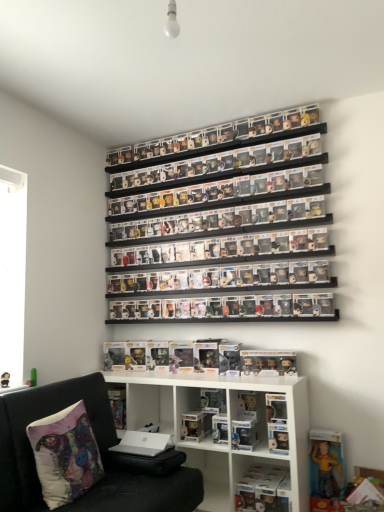
Describe the element at coordinates (260, 488) in the screenshot. I see `clear plastic figure at lower center` at that location.

Describe the element at coordinates (65, 455) in the screenshot. I see `white fabric pillow with colorful design at lower left` at that location.

Describe the element at coordinates (101, 457) in the screenshot. I see `black fabric couch at lower left` at that location.

Measure the distance between point (76, 380) and camera.

8.03 feet.

The width and height of the screenshot is (384, 512). In order to click on clear plastic figures at upper center, the fourth shelf ordered from the bottom in this screenshot , I will do coord(212,137).

Describe the element at coordinates (325, 469) in the screenshot. This screenshot has width=384, height=512. I see `yellow fabric figure at lower right, acting as the 1th toy starting from the bottom` at that location.

Image resolution: width=384 pixels, height=512 pixels. In order to click on clear plastic figure at lower center in this screenshot , I will do (260, 488).

Does point (76, 437) come behind point (293, 352)?

No, (76, 437) is in front of (293, 352).

From a real-world perspective, does white fabric pillow with colorful design at lower left sit lower than translucent plastic figures at lower center, marked as the first toy in a top-to-bottom arrangement?

Indeed, from a real-world perspective, white fabric pillow with colorful design at lower left is positioned beneath translucent plastic figures at lower center, marked as the first toy in a top-to-bottom arrangement.

What are the coordinates of `pillow on the left side of translucent plastic figures at lower center, marked as the second toy in a right-to-left arrangement` in the screenshot? It's located at (65, 455).

From the image's perspective, which one is positioned lower, white fabric pillow with colorful design at lower left or translucent plastic figures at lower center, marked as the first toy in a top-to-bottom arrangement?

From the image's view, white fabric pillow with colorful design at lower left is below.

Considering the relative sizes of white fabric pillow with colorful design at lower left and clear plastic figures at upper center, the fourth shelf ordered from the bottom, in the image provided, is white fabric pillow with colorful design at lower left smaller than clear plastic figures at upper center, the fourth shelf ordered from the bottom,?

Actually, white fabric pillow with colorful design at lower left might be larger than clear plastic figures at upper center, the fourth shelf ordered from the bottom.

At what (x,y) coordinates should I click in order to perform the action: click on pillow on the left of clear plastic figures at upper center, marked as the 1th shelf in a top-to-bottom arrangement. Please return your answer as a coordinate pair (x, y). Looking at the image, I should click on (65, 455).

Is white fabric pillow with colorful design at lower left looking in the opposite direction of clear plastic figures at upper center, marked as the 1th shelf in a top-to-bottom arrangement?

That's not correct — white fabric pillow with colorful design at lower left is not looking away from clear plastic figures at upper center, marked as the 1th shelf in a top-to-bottom arrangement.

In terms of height, does white fabric pillow with colorful design at lower left look taller or shorter compared to clear plastic figures at upper center, marked as the 1th shelf in a top-to-bottom arrangement?

Considering their sizes, white fabric pillow with colorful design at lower left has more height than clear plastic figures at upper center, marked as the 1th shelf in a top-to-bottom arrangement.

Is clear plastic figures at center, the 2th shelf ordered from the bottom, with white matte shelf at lower center, arranged as the first shelf when ordered from the bottom?

clear plastic figures at center, the 2th shelf ordered from the bottom, and white matte shelf at lower center, arranged as the first shelf when ordered from the bottom, are clearly separated.

How many degrees apart are the facing directions of clear plastic figures at center, the third shelf when ordered from top to bottom, and white matte shelf at lower center, positioned as the 4th shelf in top-to-bottom order?

clear plastic figures at center, the third shelf when ordered from top to bottom, and white matte shelf at lower center, positioned as the 4th shelf in top-to-bottom order, are facing 0.694 degrees away from each other.

Is clear plastic figures at center, the 2th shelf ordered from the bottom, further to camera compared to white matte shelf at lower center, positioned as the 4th shelf in top-to-bottom order?

Yes, clear plastic figures at center, the 2th shelf ordered from the bottom, is behind white matte shelf at lower center, positioned as the 4th shelf in top-to-bottom order.

Is clear plastic figures at center, the third shelf when ordered from top to bottom, facing away from white matte shelf at lower center, positioned as the 4th shelf in top-to-bottom order?

No, clear plastic figures at center, the third shelf when ordered from top to bottom,'s orientation is not away from white matte shelf at lower center, positioned as the 4th shelf in top-to-bottom order.

Consider the image. From a real-world perspective, between matte plastic figurine at center, positioned as the 1th toy in left-to-right order, and clear plastic figures at center, the 2th shelf ordered from the bottom, who is vertically lower?

matte plastic figurine at center, positioned as the 1th toy in left-to-right order, is physically lower.

Does matte plastic figurine at center, positioned as the second toy in bottom-to-top order, contain clear plastic figures at center, the third shelf when ordered from top to bottom?

No, clear plastic figures at center, the third shelf when ordered from top to bottom, is not surrounded by matte plastic figurine at center, positioned as the second toy in bottom-to-top order.

Is matte plastic figurine at center, the 2th toy from the top, bigger than clear plastic figures at center, the 2th shelf ordered from the bottom?

Actually, matte plastic figurine at center, the 2th toy from the top, might be smaller than clear plastic figures at center, the 2th shelf ordered from the bottom.

Looking at their sizes, would you say black fabric couch at lower left is wider or thinner than clear plastic figures at center, which appears as the 2th shelf when viewed from the top?

black fabric couch at lower left is wider than clear plastic figures at center, which appears as the 2th shelf when viewed from the top.

Is black fabric couch at lower left looking in the opposite direction of clear plastic figures at center, which appears as the 2th shelf when viewed from the top?

No, black fabric couch at lower left is not facing away from clear plastic figures at center, which appears as the 2th shelf when viewed from the top.

Which point is more distant from viewer, (33, 463) or (114, 206)?

Point (114, 206)

Between black fabric couch at lower left and clear plastic figures at center, which ranks as the third shelf in bottom-to-top order, which one has larger size?

With larger size is black fabric couch at lower left.

From the image's perspective, is clear plastic figures at upper center, marked as the 1th shelf in a top-to-bottom arrangement, under clear plastic figures at center, which ranks as the third shelf in bottom-to-top order?

Incorrect, from the image's perspective, clear plastic figures at upper center, marked as the 1th shelf in a top-to-bottom arrangement, is higher than clear plastic figures at center, which ranks as the third shelf in bottom-to-top order.

From the picture: Can you confirm if clear plastic figures at upper center, marked as the 1th shelf in a top-to-bottom arrangement, is positioned to the right of clear plastic figures at center, which ranks as the third shelf in bottom-to-top order?

Incorrect, clear plastic figures at upper center, marked as the 1th shelf in a top-to-bottom arrangement, is not on the right side of clear plastic figures at center, which ranks as the third shelf in bottom-to-top order.

Does clear plastic figures at upper center, the fourth shelf ordered from the bottom, turn towards clear plastic figures at center, which appears as the 2th shelf when viewed from the top?

No, clear plastic figures at upper center, the fourth shelf ordered from the bottom, is not facing towards clear plastic figures at center, which appears as the 2th shelf when viewed from the top.

Which is less distant, (167, 144) or (321, 166)?

The point (321, 166) is closer to the camera.

Considering the relative sizes of translucent plastic figures at lower center, marked as the second toy in a right-to-left arrangement, and clear plastic figure at lower center in the image provided, is translucent plastic figures at lower center, marked as the second toy in a right-to-left arrangement, bigger than clear plastic figure at lower center?

No, translucent plastic figures at lower center, marked as the second toy in a right-to-left arrangement, is not bigger than clear plastic figure at lower center.

Is translucent plastic figures at lower center, acting as the third toy starting from the bottom, directly adjacent to clear plastic figure at lower center?

No, translucent plastic figures at lower center, acting as the third toy starting from the bottom, is not with clear plastic figure at lower center.

Find the location of a particular element. The height and width of the screenshot is (512, 384). book that is in front of the translucent plastic figures at lower center, marked as the first toy in a top-to-bottom arrangement is located at coordinates (260, 488).

Identify the location of pillow below the translucent plastic figures at lower center, acting as the third toy starting from the bottom (from the image's perspective). (65, 455).

Which shelf is the 2nd one when counting from the right side of the white fabric pillow with colorful design at lower left? Please provide its 2D coordinates.

[(212, 137)]

Based on their spatial positions, is white fabric pillow with colorful design at lower left or clear plastic figures at center, which ranks as the third shelf in bottom-to-top order, further from clear plastic figure at lower center?

The object further to clear plastic figure at lower center is clear plastic figures at center, which ranks as the third shelf in bottom-to-top order.

When comparing their distances from black fabric couch at lower left, does clear plastic figure at lower center or matte plastic figurine at center, which appears as the 3th toy when viewed from the right, seem further?

The object further to black fabric couch at lower left is matte plastic figurine at center, which appears as the 3th toy when viewed from the right.

Looking at the image, which one is located further to clear plastic figures at upper center, marked as the 1th shelf in a top-to-bottom arrangement, white matte shelf at lower center, positioned as the 4th shelf in top-to-bottom order, or translucent plastic figures at lower center, marked as the first toy in a top-to-bottom arrangement?

white matte shelf at lower center, positioned as the 4th shelf in top-to-bottom order.

Estimate the real-world distances between objects in this image. Which object is further from clear plastic figures at center, which appears as the 2th shelf when viewed from the top, matte plastic figurine at center, which appears as the 3th toy when viewed from the right, or clear plastic figures at upper center, the fourth shelf ordered from the bottom?

matte plastic figurine at center, which appears as the 3th toy when viewed from the right, is positioned further to the anchor clear plastic figures at center, which appears as the 2th shelf when viewed from the top.

When comparing their distances from clear plastic figures at upper center, the fourth shelf ordered from the bottom, does yellow fabric figure at lower right, which is the 3th toy from left to right, or black fabric couch at lower left seem further?

Based on the image, yellow fabric figure at lower right, which is the 3th toy from left to right, appears to be further to clear plastic figures at upper center, the fourth shelf ordered from the bottom.

When comparing their distances from matte plastic figurine at center, which appears as the 3th toy when viewed from the right, does yellow fabric figure at lower right, acting as the 1th toy starting from the bottom, or clear plastic figures at center, which ranks as the third shelf in bottom-to-top order, seem further?

clear plastic figures at center, which ranks as the third shelf in bottom-to-top order, is further to matte plastic figurine at center, which appears as the 3th toy when viewed from the right.

From the picture: Considering their positions, is translucent plastic figures at lower center, acting as the third toy starting from the bottom, positioned further to clear plastic figures at center, the 2th shelf ordered from the bottom, than white matte shelf at lower center, arranged as the first shelf when ordered from the bottom?

The object further to clear plastic figures at center, the 2th shelf ordered from the bottom, is white matte shelf at lower center, arranged as the first shelf when ordered from the bottom.

Considering their positions, is yellow fabric figure at lower right, which is the 3th toy from left to right, positioned further to translucent plastic figures at lower center, marked as the first toy in a top-to-bottom arrangement, than clear plastic figures at upper center, marked as the 1th shelf in a top-to-bottom arrangement?

clear plastic figures at upper center, marked as the 1th shelf in a top-to-bottom arrangement, is positioned further to the anchor translucent plastic figures at lower center, marked as the first toy in a top-to-bottom arrangement.

What are the coordinates of `shelf between black fabric couch at lower left and yellow fabric figure at lower right, acting as the first toy starting from the right, along the z-axis` in the screenshot? It's located at (228, 426).

Where is `book between white fabric pillow with colorful design at lower left and translucent plastic figures at lower center, acting as the third toy starting from the bottom`? book between white fabric pillow with colorful design at lower left and translucent plastic figures at lower center, acting as the third toy starting from the bottom is located at coordinates (260, 488).

Identify the location of pillow positioned between black fabric couch at lower left and clear plastic figures at center, which appears as the 2th shelf when viewed from the top, from near to far. (65, 455).

Where is `pillow between clear plastic figures at upper center, marked as the 1th shelf in a top-to-bottom arrangement, and black fabric couch at lower left, in the vertical direction`? pillow between clear plastic figures at upper center, marked as the 1th shelf in a top-to-bottom arrangement, and black fabric couch at lower left, in the vertical direction is located at coordinates point(65,455).